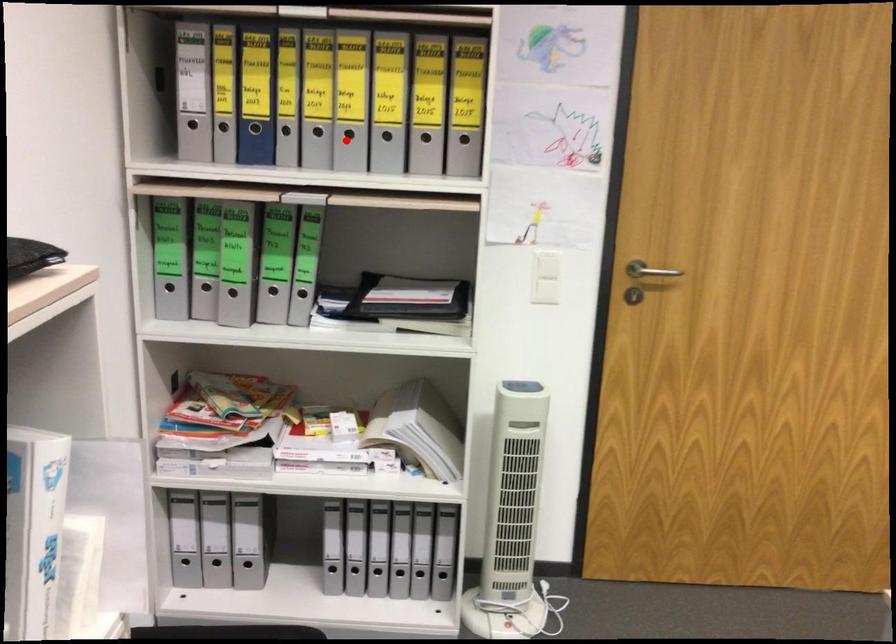
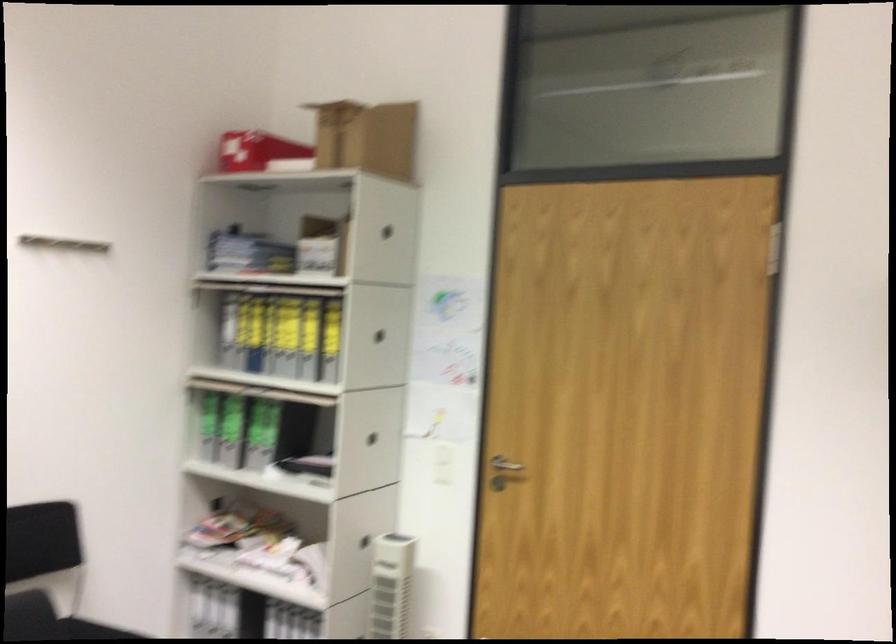
The point at the highlighted location is marked in the first image. Where is the corresponding point in the second image?

(289, 359)